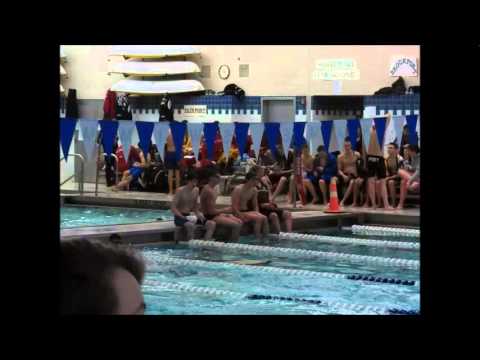
Locate an element on the screen. The image size is (480, 360). poster is located at coordinates (396, 68).